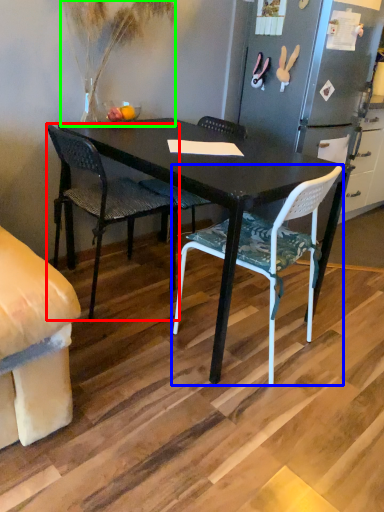
Question: Which object is positioned farthest from chair (highlighted by a red box)? Select from chair (highlighted by a blue box) and houseplant (highlighted by a green box).

Choices:
 (A) chair
 (B) houseplant

Answer: (A)